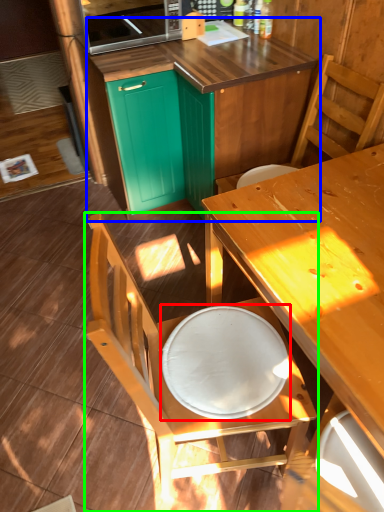
Question: Which object is positioned closest to round table (highlighted by a red box)? Select from cabinetry (highlighted by a blue box) and chair (highlighted by a green box).

Choices:
 (A) cabinetry
 (B) chair

Answer: (B)